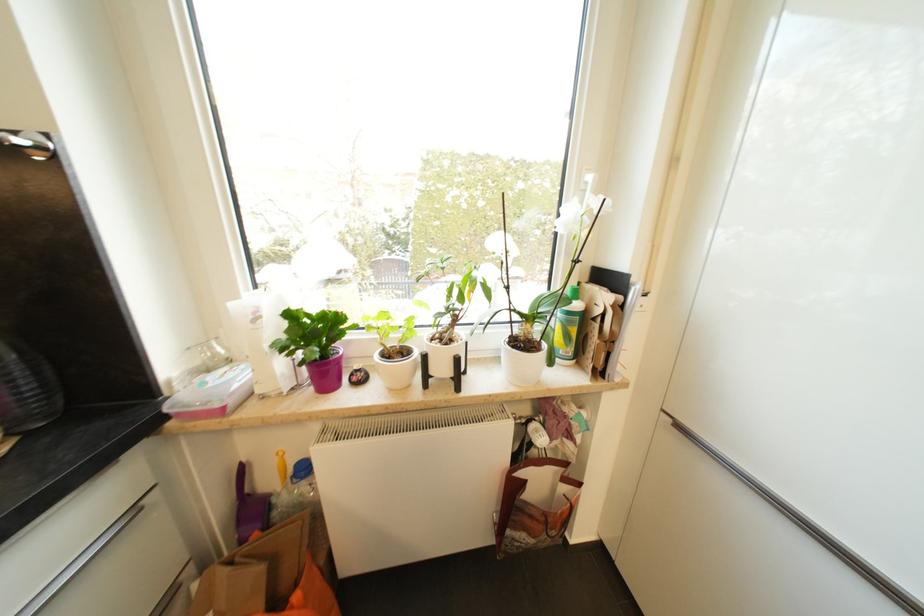
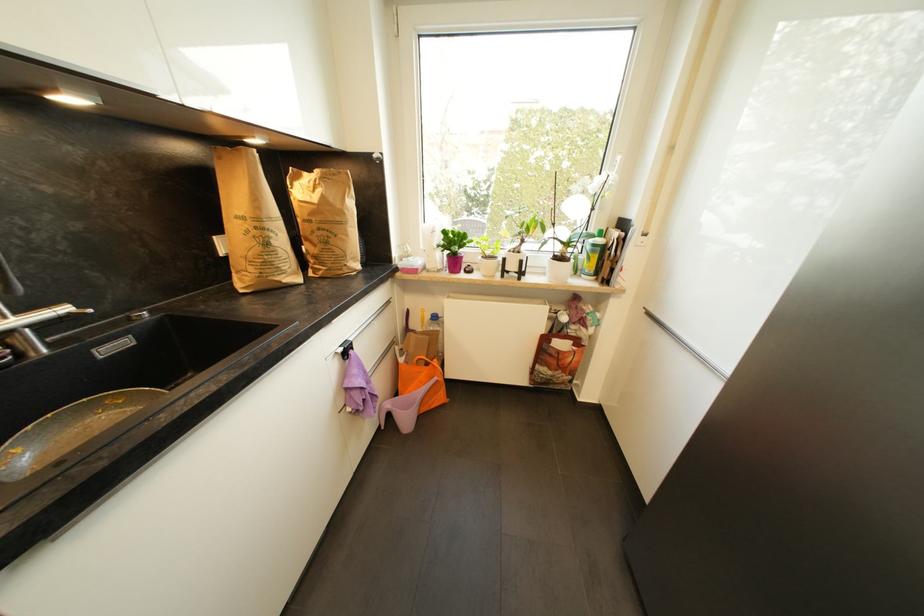
In the second image, find the point that corresponds to pixel 381 358 in the first image.

(484, 259)